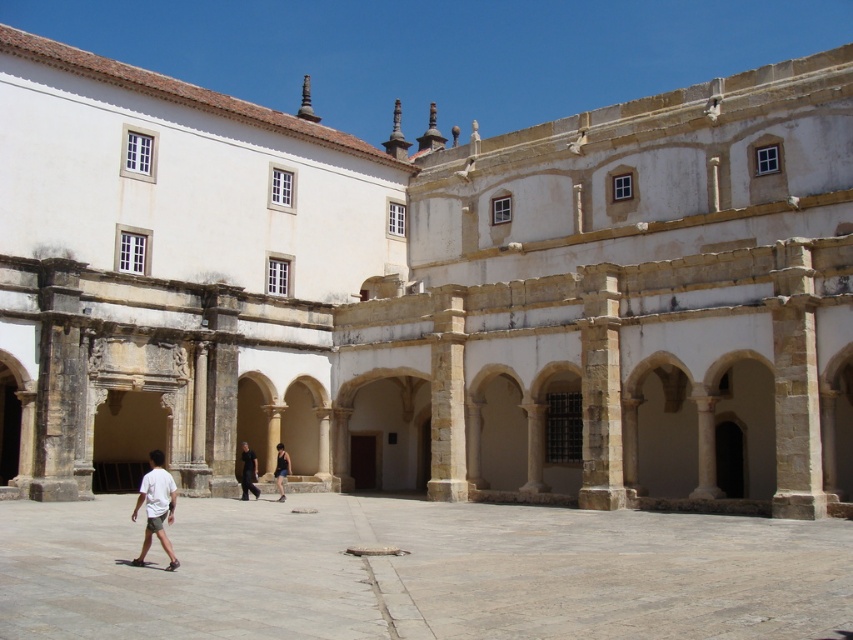
The width and height of the screenshot is (853, 640). In order to click on smooth stone courtyard at center in this screenshot , I will do `click(419, 572)`.

Is point (409, 563) positioned before point (286, 474)?

Yes, it is.

The height and width of the screenshot is (640, 853). I want to click on smooth stone courtyard at center, so click(419, 572).

Between smooth stone courtyard at center and white cotton shirt at lower left, which one is positioned higher?

Positioned higher is white cotton shirt at lower left.

Can you confirm if smooth stone courtyard at center is positioned below white cotton shirt at lower left?

Yes.

The image size is (853, 640). What are the coordinates of `smooth stone courtyard at center` in the screenshot? It's located at (419, 572).

Is white cotton shirt at lower left above dark blue denim shorts at center?

Correct, white cotton shirt at lower left is located above dark blue denim shorts at center.

Is white cotton shirt at lower left positioned in front of dark blue denim shorts at center?

Yes, it is.

Between point (167, 513) and point (280, 444), which one is positioned behind?

Point (280, 444)

You are a GUI agent. You are given a task and a screenshot of the screen. Output one action in this format:
    pyautogui.click(x=<x>, y=<y>)
    Task: Click on the white cotton shirt at lower left
    
    Given the screenshot: What is the action you would take?
    pyautogui.click(x=155, y=508)